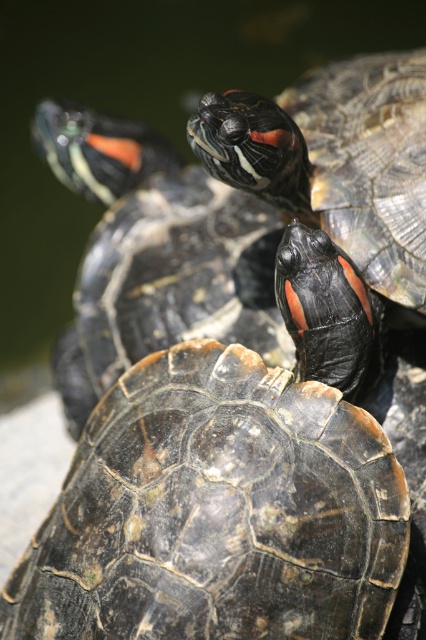
Consider the image. You are a photographer trying to capture a closeup of the shiny dark tortoise at center and the shiny black turtle at upper right. Based on their positions, which turtle is closer to the left side of your camera frame?

The shiny dark tortoise at center is to the left of the shiny black turtle at upper right, so the shiny dark tortoise at center is closer to the left side of the camera frame.

In the scene shown: You are a wildlife photographer aiming to capture closeup shots of the shiny dark tortoise at center and the shiny black turtle at upper right. Since you want to ensure both subjects are in focus, you need to know which one is bigger. Which turtle is larger?

The shiny dark tortoise at center is larger than the shiny black turtle at upper right.

You are a photographer aiming to capture a closeup shot of the turtles in the image. You want to focus on the point at coordinates point (86, 500). If your camera is set to a focal length of 50mm and your current distance to the point is 1.32 meters, what adjustment should you make to ensure the turtles remain in focus?

The distance of point (86, 500) from camera is 1.32 meters. To ensure the turtles remain in focus, you should maintain your current distance of 1.32 meters to the point since that is the exact focal point for the camera settings provided.